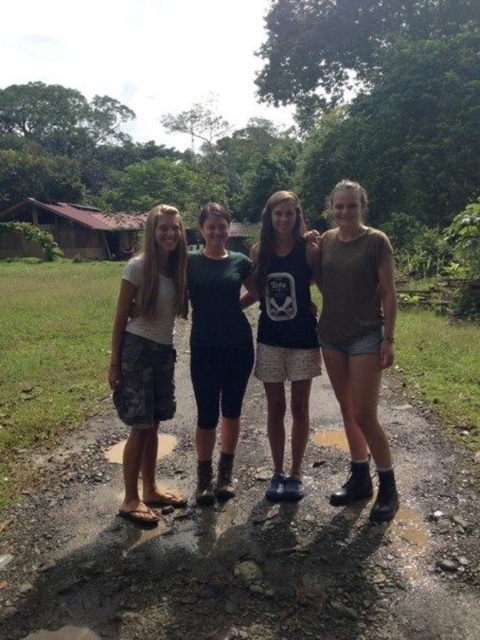
Between camo shorts at left and green knit dress at center, which one appears on the left side from the viewer's perspective?

camo shorts at left is more to the left.

Is camo shorts at left bigger than green knit dress at center?

Indeed, camo shorts at left has a larger size compared to green knit dress at center.

Locate an element on the screen. camo shorts at left is located at coordinates (147, 355).

Which is in front, point (317, 406) or point (141, 308)?

Point (141, 308) is in front.

Does brown dirt track at center have a larger size compared to camo shorts at left?

Actually, brown dirt track at center might be smaller than camo shorts at left.

Image resolution: width=480 pixels, height=640 pixels. I want to click on brown dirt track at center, so click(252, 547).

Locate an element on the screen. The width and height of the screenshot is (480, 640). brown dirt track at center is located at coordinates (252, 547).

Who is taller, camo shorts at left or brown corrugated metal hut at left?

With more height is brown corrugated metal hut at left.

Does camo shorts at left have a lesser width compared to brown corrugated metal hut at left?

Correct, camo shorts at left's width is less than brown corrugated metal hut at left's.

Is point (142, 419) farther from camera compared to point (15, 212)?

No, it is in front of (15, 212).

In order to click on camo shorts at left in this screenshot , I will do `click(147, 355)`.